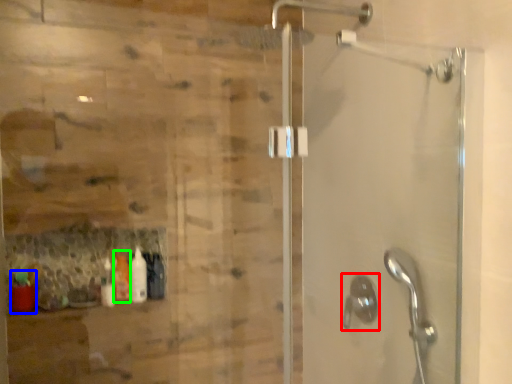
Question: Based on their relative distances, which object is farther from shower (highlighted by a red box)? Choose from bottle (highlighted by a blue box) and bottle (highlighted by a green box).

Choices:
 (A) bottle
 (B) bottle

Answer: (A)